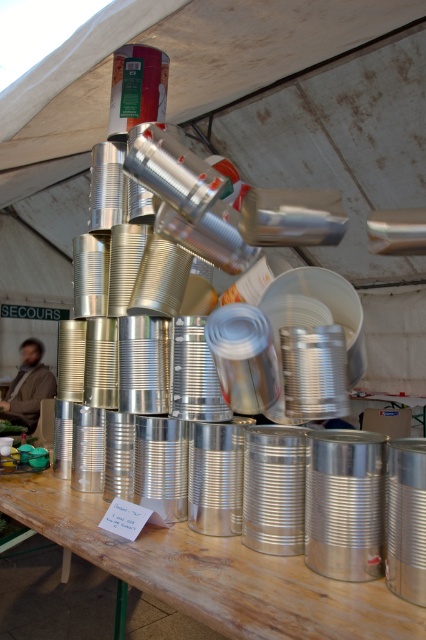
Which is more to the left, wooden table at center or brown fuzzy jacket at lower left?

brown fuzzy jacket at lower left is more to the left.

Can you confirm if wooden table at center is smaller than brown fuzzy jacket at lower left?

Yes.

Between point (36, 476) and point (23, 390), which one is positioned behind?

Positioned behind is point (23, 390).

This screenshot has width=426, height=640. Identify the location of wooden table at center. (213, 572).